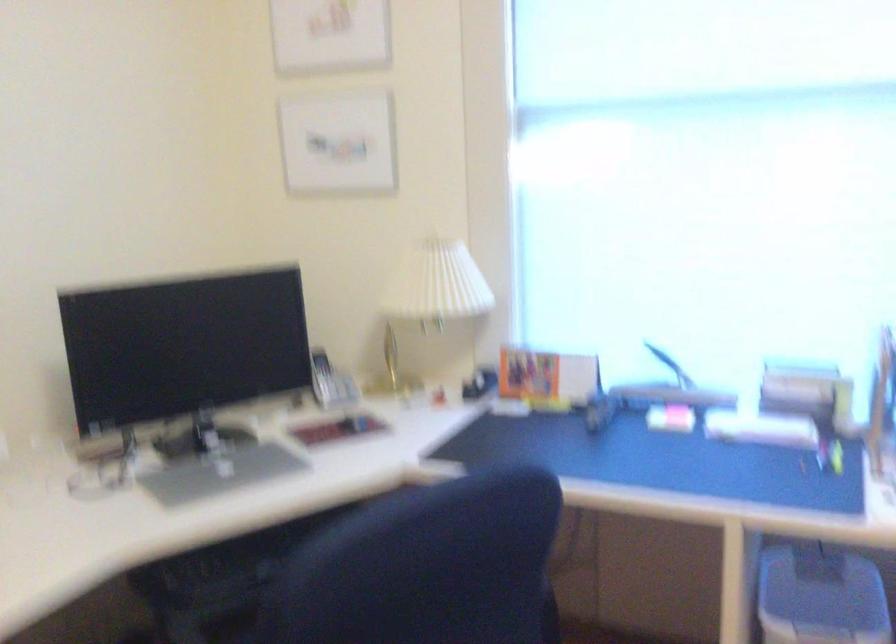
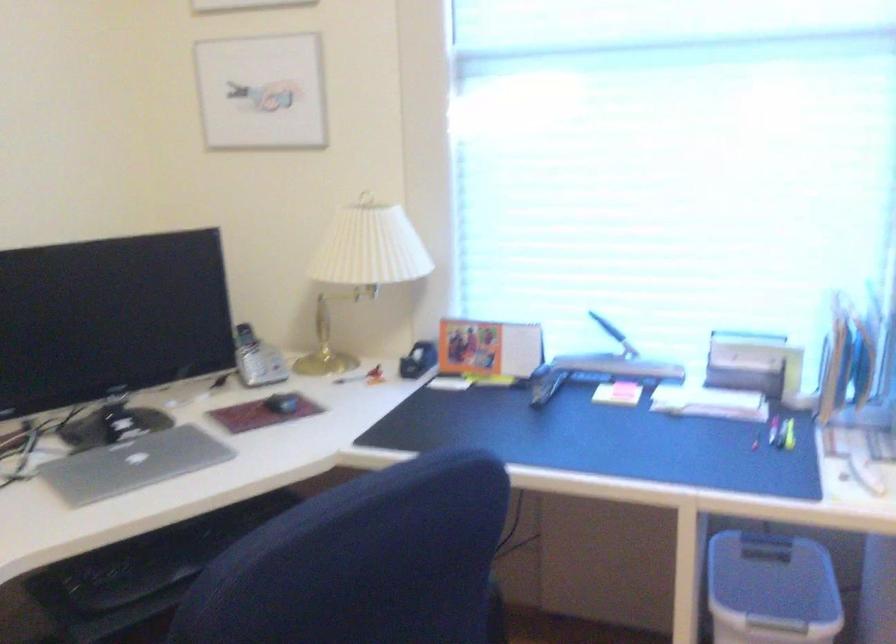
Where in the second image is the point corresponding to [219,477] from the first image?

(133, 464)